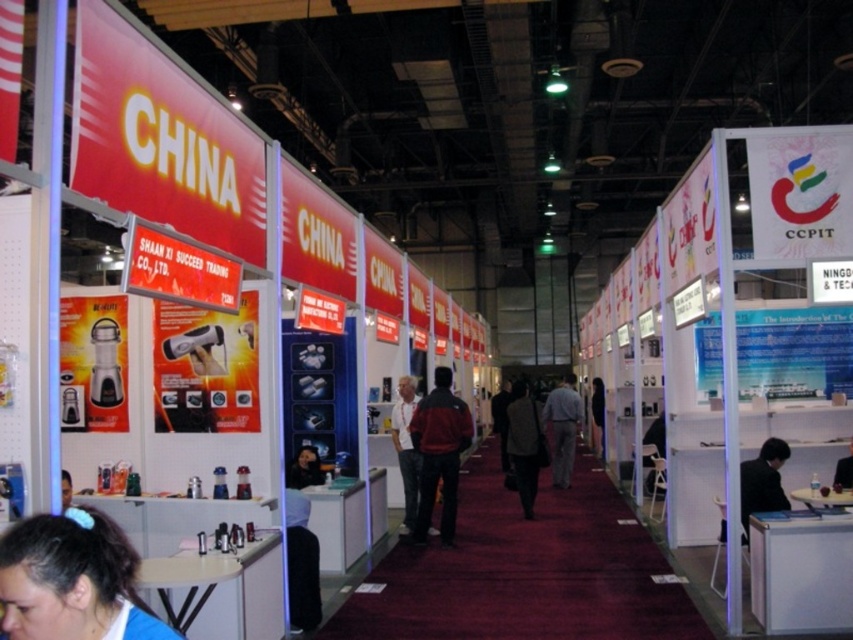
Question: Which point appears farthest from the camera in this image?

Choices:
 (A) (561, 435)
 (B) (509, 476)
 (C) (434, 401)

Answer: (A)

Question: Is dark brown hair at lower left bigger than dark gray fabric jacket at center?

Choices:
 (A) yes
 (B) no

Answer: (B)

Question: Which point appears closest to the camera in this image?

Choices:
 (A) (572, 381)
 (B) (834, 474)

Answer: (B)

Question: Is red jacket at center below black fabric jacket at lower right?

Choices:
 (A) yes
 (B) no

Answer: (A)

Question: Among these objects, which one is nearest to the camera?

Choices:
 (A) black fabric jacket at lower right
 (B) dark brown hair at lower left
 (C) dark gray fabric jacket at center

Answer: (B)

Question: Is dark brown hair at lower left bigger than dark brown leather jacket at center?

Choices:
 (A) yes
 (B) no

Answer: (B)